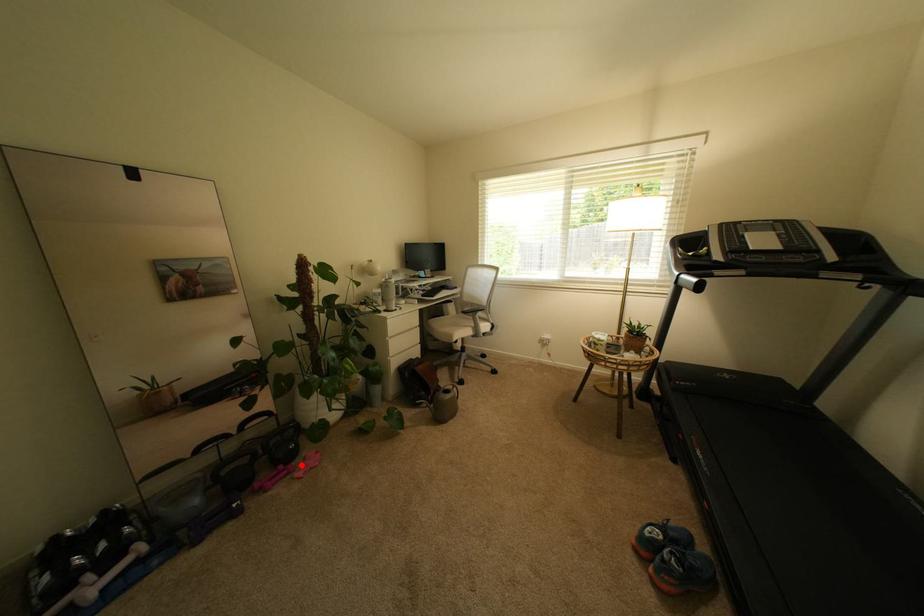
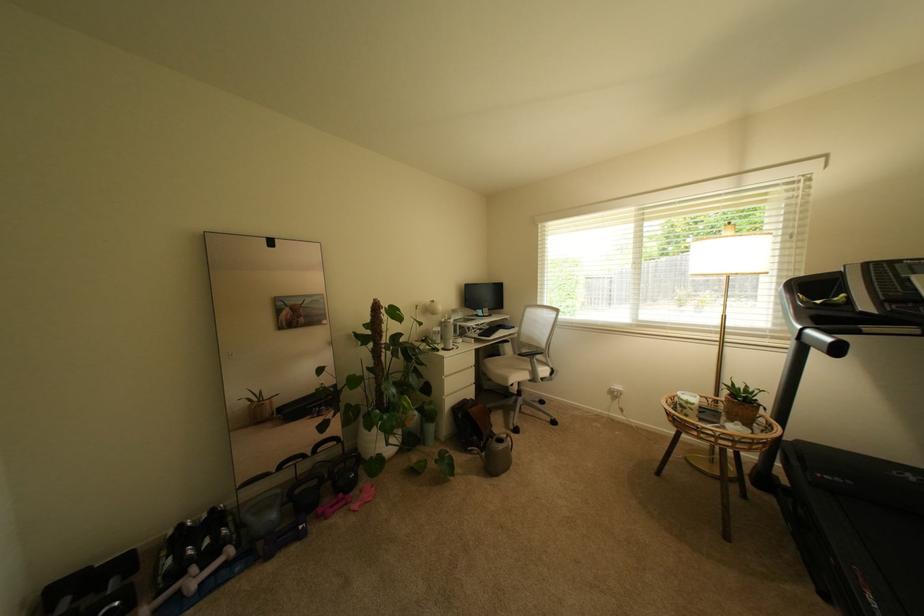
Question: I am providing you with two images of the same scene from different viewpoints. In image1, a red point is highlighted. Considering the same 3D point in image2, which of the following is correct?

Choices:
 (A) It is closer
 (B) It is farther

Answer: (B)